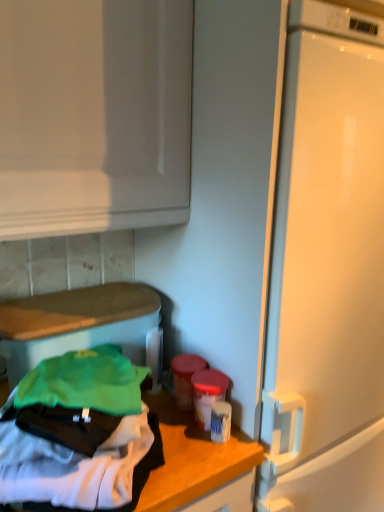
Measure the distance between white matte countertop at lower left and camera.

The distance of white matte countertop at lower left from camera is 31.28 inches.

This screenshot has width=384, height=512. Describe the element at coordinates (198, 465) in the screenshot. I see `white matte countertop at lower left` at that location.

What is the approximate height of white matte countertop at lower left?

white matte countertop at lower left is 6.95 centimeters in height.

Image resolution: width=384 pixels, height=512 pixels. What are the coordinates of `white matte countertop at lower left` in the screenshot? It's located at (198, 465).

Measure the distance between point (x=69, y=340) and camera.

The depth of point (x=69, y=340) is 1.02 meters.

This screenshot has width=384, height=512. What are the coordinates of `matte green fabric at lower left` in the screenshot? It's located at (76, 324).

What do you see at coordinates (76, 324) in the screenshot? This screenshot has width=384, height=512. I see `matte green fabric at lower left` at bounding box center [76, 324].

Identify the location of white matte countertop at lower left. This screenshot has width=384, height=512. (198, 465).

Is white matte countertop at lower left at the left side of matte green fabric at lower left?

No, white matte countertop at lower left is not to the left of matte green fabric at lower left.

Considering their positions, is white matte countertop at lower left located in front of or behind matte green fabric at lower left?

In the image, white matte countertop at lower left appears in front of matte green fabric at lower left.

Does point (172, 457) appear closer or farther from the camera than point (38, 298)?

Point (172, 457).

Consider the image. From the image's perspective, is white matte countertop at lower left over matte green fabric at lower left?

Incorrect, from the image's perspective, white matte countertop at lower left is lower than matte green fabric at lower left.

From a real-world perspective, is white matte countertop at lower left below matte green fabric at lower left?

Yes, from a real-world perspective, white matte countertop at lower left is under matte green fabric at lower left.

Looking at their sizes, would you say white matte countertop at lower left is wider or thinner than matte green fabric at lower left?

Considering their sizes, white matte countertop at lower left looks broader than matte green fabric at lower left.

Is white matte countertop at lower left shorter than matte green fabric at lower left?

Correct, white matte countertop at lower left is not as tall as matte green fabric at lower left.

Who is bigger, white matte countertop at lower left or matte green fabric at lower left?

matte green fabric at lower left.

Can matte green fabric at lower left be found inside white matte countertop at lower left?

No.

Is white matte countertop at lower left with matte green fabric at lower left?

No, white matte countertop at lower left is not in contact with matte green fabric at lower left.

Is white matte countertop at lower left looking in the opposite direction of matte green fabric at lower left?

Yes.

How different are the orientations of white matte countertop at lower left and matte green fabric at lower left in degrees?

They differ by 31.4 degrees in their facing directions.

The width and height of the screenshot is (384, 512). Identify the location of appliance lying on the left of white matte countertop at lower left. (76, 324).

Consider the image. Considering the relative positions of matte green fabric at lower left and white matte countertop at lower left in the image provided, is matte green fabric at lower left to the left or to the right of white matte countertop at lower left?

Clearly, matte green fabric at lower left is on the left of white matte countertop at lower left in the image.

Is matte green fabric at lower left behind white matte countertop at lower left?

Yes, it is behind white matte countertop at lower left.

Which is nearer, (50,329) or (247,493)?

A: The point (247,493) is closer to the camera.

From the image's perspective, is matte green fabric at lower left over white matte countertop at lower left?

Yes, from the image's perspective, matte green fabric at lower left is above white matte countertop at lower left.

From a real-world perspective, is matte green fabric at lower left physically above white matte countertop at lower left?

Indeed, from a real-world perspective, matte green fabric at lower left stands above white matte countertop at lower left.

Is matte green fabric at lower left wider than white matte countertop at lower left?

In fact, matte green fabric at lower left might be narrower than white matte countertop at lower left.

Who is shorter, matte green fabric at lower left or white matte countertop at lower left?

white matte countertop at lower left is shorter.

Considering the sizes of objects matte green fabric at lower left and white matte countertop at lower left in the image provided, who is smaller, matte green fabric at lower left or white matte countertop at lower left?

With smaller size is white matte countertop at lower left.

Is matte green fabric at lower left positioned beyond the bounds of white matte countertop at lower left?

That's correct, matte green fabric at lower left is outside of white matte countertop at lower left.

Is matte green fabric at lower left with white matte countertop at lower left?

No, matte green fabric at lower left is not with white matte countertop at lower left.

Is matte green fabric at lower left oriented towards white matte countertop at lower left?

Yes, matte green fabric at lower left is oriented towards white matte countertop at lower left.

Looking at this image, what's the angular difference between matte green fabric at lower left and white matte countertop at lower left's facing directions?

The angle between the facing direction of matte green fabric at lower left and the facing direction of white matte countertop at lower left is 31.4 degrees.

Where is `countertop on the right of matte green fabric at lower left`? countertop on the right of matte green fabric at lower left is located at coordinates (198, 465).

You are a GUI agent. You are given a task and a screenshot of the screen. Output one action in this format:
    pyautogui.click(x=<x>, y=<y>)
    Task: Click on the countertop directly beneath the matte green fabric at lower left (from a real-world perspective)
    The image size is (384, 512).
    Given the screenshot: What is the action you would take?
    pyautogui.click(x=198, y=465)

Where is `countertop in front of the matte green fabric at lower left`? This screenshot has width=384, height=512. countertop in front of the matte green fabric at lower left is located at coordinates (198, 465).